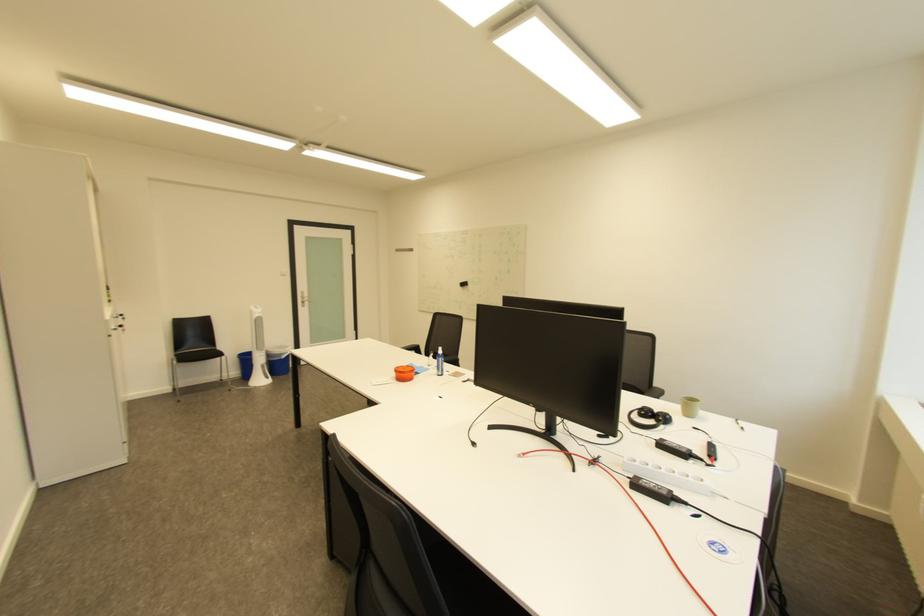
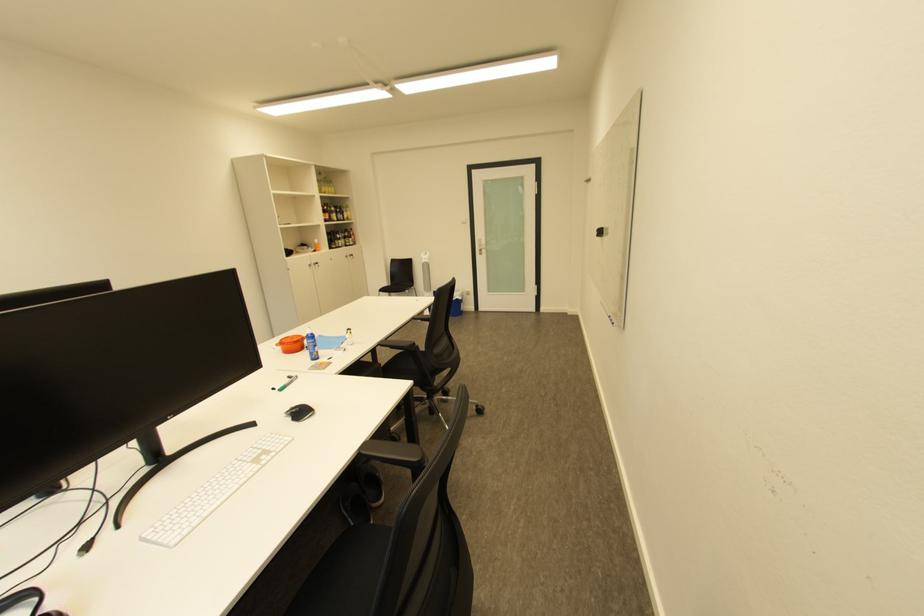
Locate, in the second image, the point that corresponds to the point at 134,331 in the first image.

(329, 267)